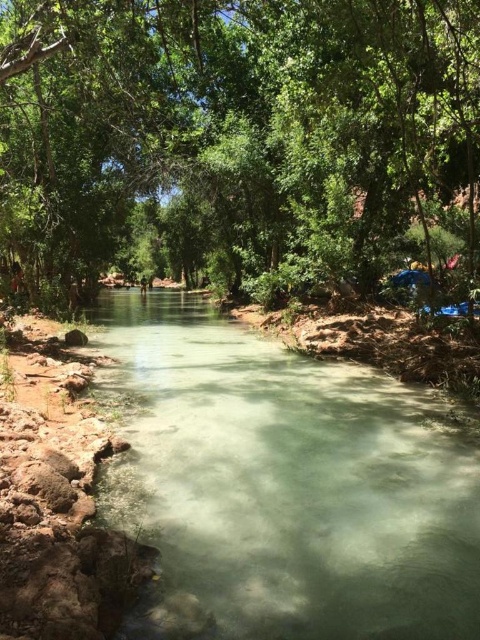
Is green leafy tree at center taller than clear water at center?

Indeed, green leafy tree at center has a greater height compared to clear water at center.

Does point (103, 65) come behind point (458, 627)?

Yes, it is.

You are a GUI agent. You are given a task and a screenshot of the screen. Output one action in this format:
    pyautogui.click(x=<x>, y=<y>)
    Task: Click on the green leafy tree at center
    The height and width of the screenshot is (640, 480).
    Given the screenshot: What is the action you would take?
    pyautogui.click(x=237, y=144)